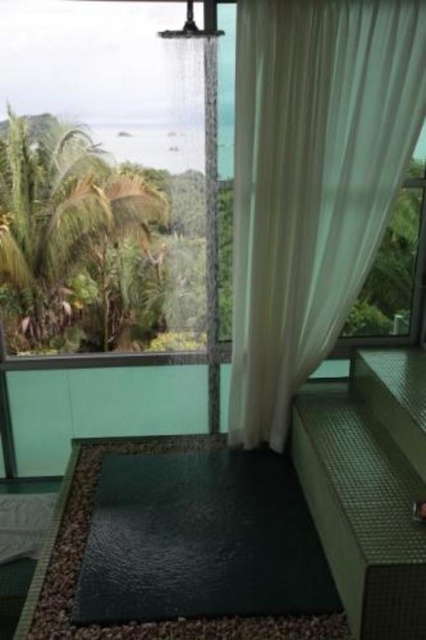
You are standing in the shower area and want to adjust the white sheer curtain at upper center. If your arm can reach up to 2.5 meters, can you comfortably reach it?

The white sheer curtain at upper center is 8.24 feet away from the camera. Since 8.24 feet is approximately 2.51 meters, your arm can just barely reach it if you stretch out your arm fully.

You are standing in the outdoor shower area and want to adjust the privacy settings. The shower has a white sheer curtain at upper center and a transparent glass window at upper left. Which object is positioned to the right side of the other?

The white sheer curtain at upper center is to the right of the transparent glass window at upper left, so the white sheer curtain at upper center is positioned to the right side of the transparent glass window at upper left.